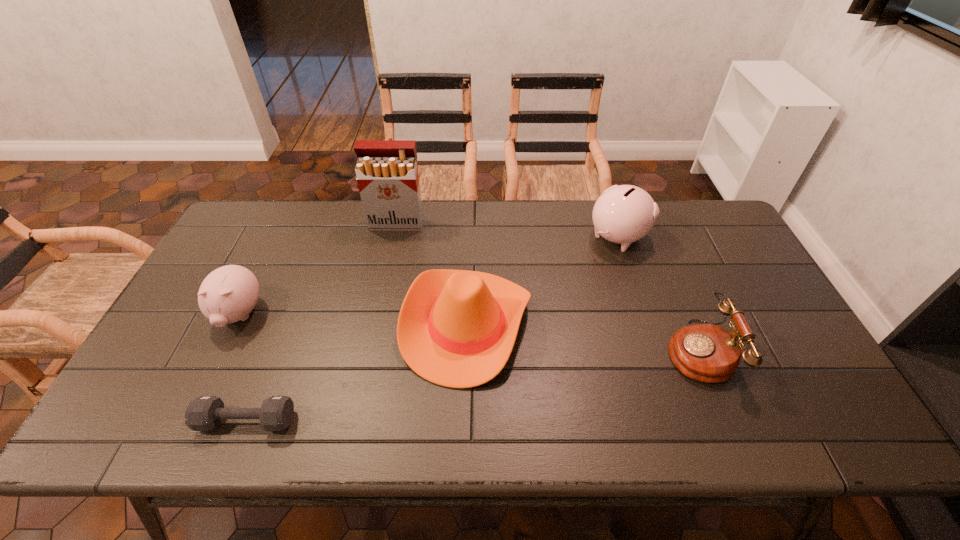
The width and height of the screenshot is (960, 540). I want to click on vacant region located on the front of the right piggy bank, so click(x=660, y=366).

Where is `vacant space located 0.280m on the back of the cowboy hat`? The width and height of the screenshot is (960, 540). vacant space located 0.280m on the back of the cowboy hat is located at coordinates (469, 214).

The image size is (960, 540). Find the location of `free point located 0.200m on the dial of the telephone`. free point located 0.200m on the dial of the telephone is located at coordinates (588, 350).

Find the location of `vacant space located 0.240m on the dial of the telephone`. vacant space located 0.240m on the dial of the telephone is located at coordinates point(573,350).

At what (x,y) coordinates should I click in order to perform the action: click on vacant space situated on the dial of the telephone. Please return your answer as a coordinate pair (x, y). Image resolution: width=960 pixels, height=540 pixels. Looking at the image, I should click on (636, 350).

Where is `vacant area situated at the snout of the left piggy bank`? vacant area situated at the snout of the left piggy bank is located at coordinates (188, 420).

Identify the location of vacant region located 0.310m on the back of the dumbbell. Image resolution: width=960 pixels, height=540 pixels. (292, 305).

Where is `cigarette case that is at the far edge`? The image size is (960, 540). cigarette case that is at the far edge is located at coordinates (387, 174).

Locate an element on the screen. Image resolution: width=960 pixels, height=540 pixels. piggy bank that is at the far edge is located at coordinates (623, 214).

The image size is (960, 540). Find the location of `object that is at the near edge`. object that is at the near edge is located at coordinates (204, 413).